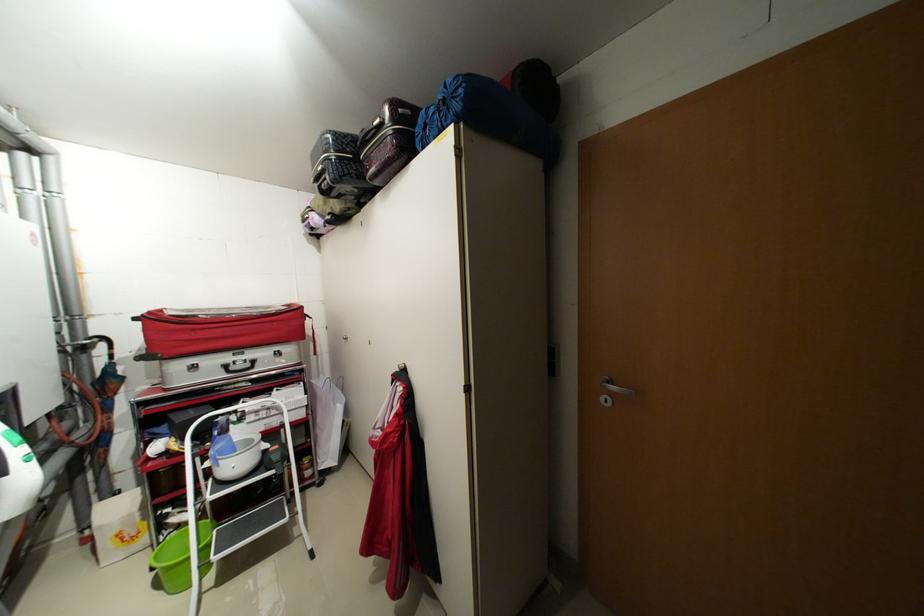
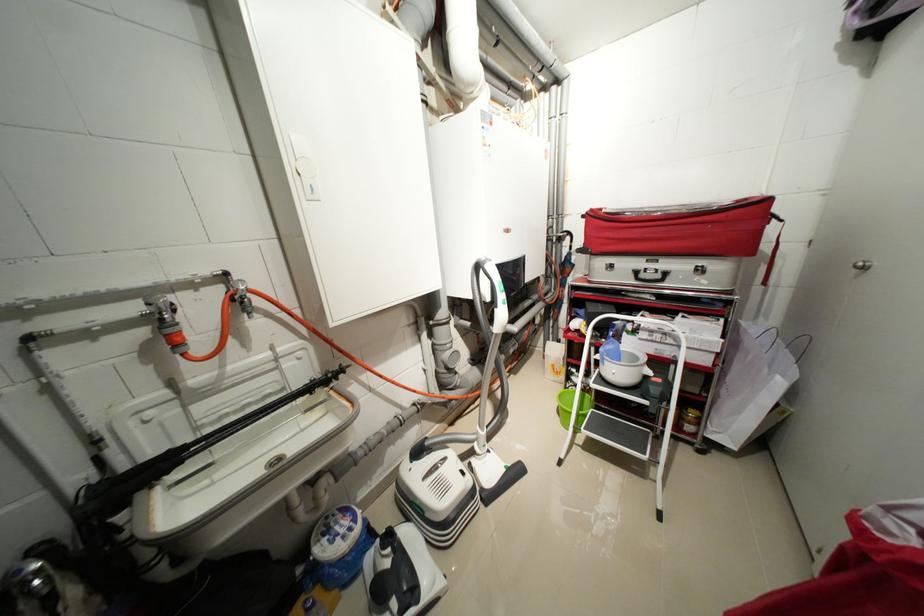
Where in the second image is the point corresponding to the point at 157,314 from the first image?

(599, 211)